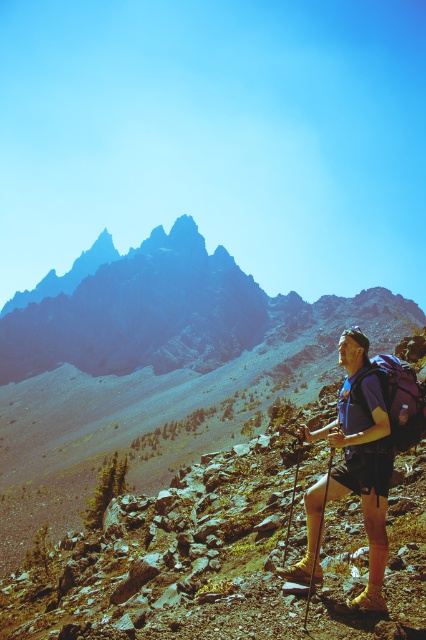
Who is positioned more to the left, rocky gray mountain at upper left or matte blue shirt at center?

rocky gray mountain at upper left is more to the left.

Is rocky gray mountain at upper left taller than matte blue shirt at center?

Yes.

Image resolution: width=426 pixels, height=640 pixels. What do you see at coordinates (141, 314) in the screenshot? I see `rocky gray mountain at upper left` at bounding box center [141, 314].

At what (x,y) coordinates should I click in order to perform the action: click on rocky gray mountain at upper left. Please return your answer as a coordinate pair (x, y). The width and height of the screenshot is (426, 640). Looking at the image, I should click on (141, 314).

Can you confirm if rocky gray mountain at upper left is positioned to the left of purple matte backpack at center-right?

Yes, rocky gray mountain at upper left is to the left of purple matte backpack at center-right.

At what (x,y) coordinates should I click in order to perform the action: click on rocky gray mountain at upper left. Please return your answer as a coordinate pair (x, y). The width and height of the screenshot is (426, 640). Looking at the image, I should click on tap(141, 314).

Is point (218, 362) in front of point (391, 406)?

No.

At what (x,y) coordinates should I click in order to perform the action: click on rocky gray mountain at upper left. Please return your answer as a coordinate pair (x, y). This screenshot has height=640, width=426. Looking at the image, I should click on (141, 314).

Who is taller, matte blue shirt at center or purple matte backpack at center-right?

matte blue shirt at center

Is the position of matte blue shirt at center more distant than that of purple matte backpack at center-right?

No, matte blue shirt at center is in front of purple matte backpack at center-right.

What do you see at coordinates (354, 467) in the screenshot? I see `matte blue shirt at center` at bounding box center [354, 467].

Where is `matte blue shirt at center`? This screenshot has width=426, height=640. matte blue shirt at center is located at coordinates (354, 467).